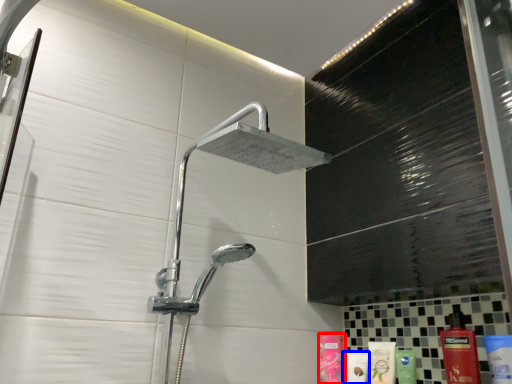
Question: Among these objects, which one is nearest to the camera, toiletry (highlighted by a red box) or toiletry (highlighted by a blue box)?

Choices:
 (A) toiletry
 (B) toiletry

Answer: (B)